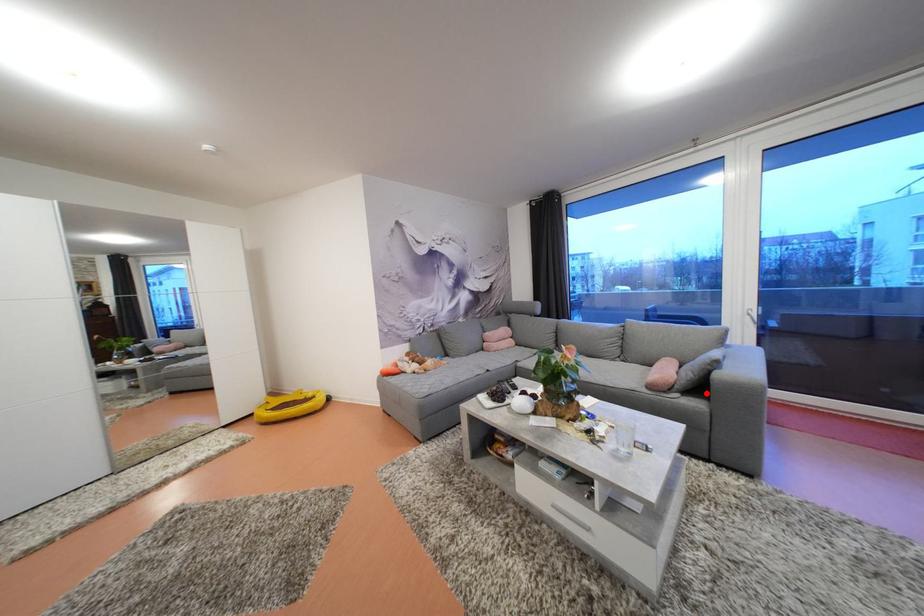
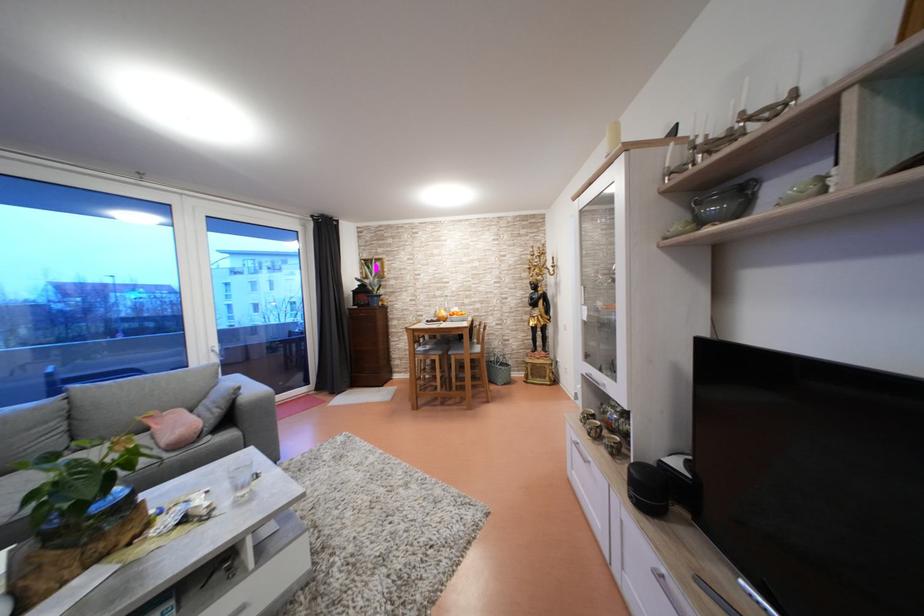
Question: I am providing you with two images of the same scene from different viewpoints. A red point is marked on the first image. At the location where the point appears in image 1, is it still visible in image 2?

Choices:
 (A) Yes
 (B) No

Answer: (A)